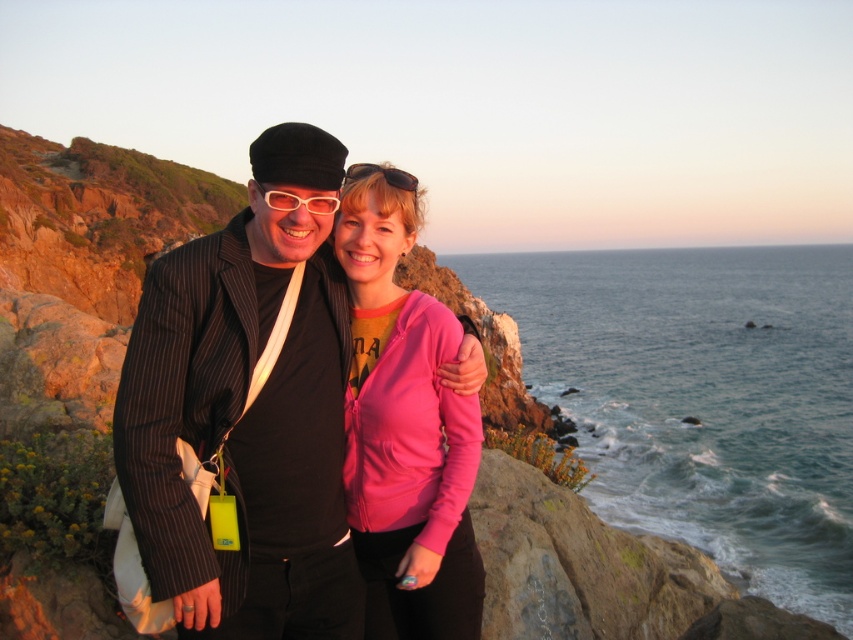
Question: Which point is farther to the camera?

Choices:
 (A) (451, 426)
 (B) (252, 440)

Answer: (A)

Question: Based on their relative distances, which object is nearer to the matte black suit at center?

Choices:
 (A) blue water at center
 (B) pink fleece jacket at center
 (C) white plastic glasses at center
 (D) pink matte sunglasses at center

Answer: (C)

Question: Can you confirm if blue water at center is smaller than pink fleece jacket at center?

Choices:
 (A) yes
 (B) no

Answer: (B)

Question: Among these points, which one is nearest to the camera?

Choices:
 (A) (409, 616)
 (B) (354, 172)
 (C) (587, 371)

Answer: (A)

Question: Can you confirm if blue water at center is bigger than white plastic glasses at center?

Choices:
 (A) yes
 (B) no

Answer: (A)

Question: Where is matte black suit at center located in relation to pink matte sunglasses at center in the image?

Choices:
 (A) below
 (B) above

Answer: (A)